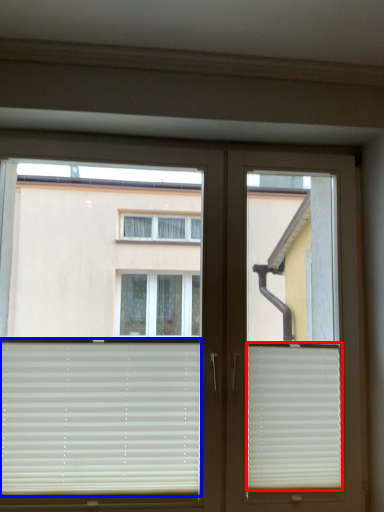
Question: Which point is further to the camera, window blind (highlighted by a red box) or window blind (highlighted by a blue box)?

Choices:
 (A) window blind
 (B) window blind

Answer: (A)